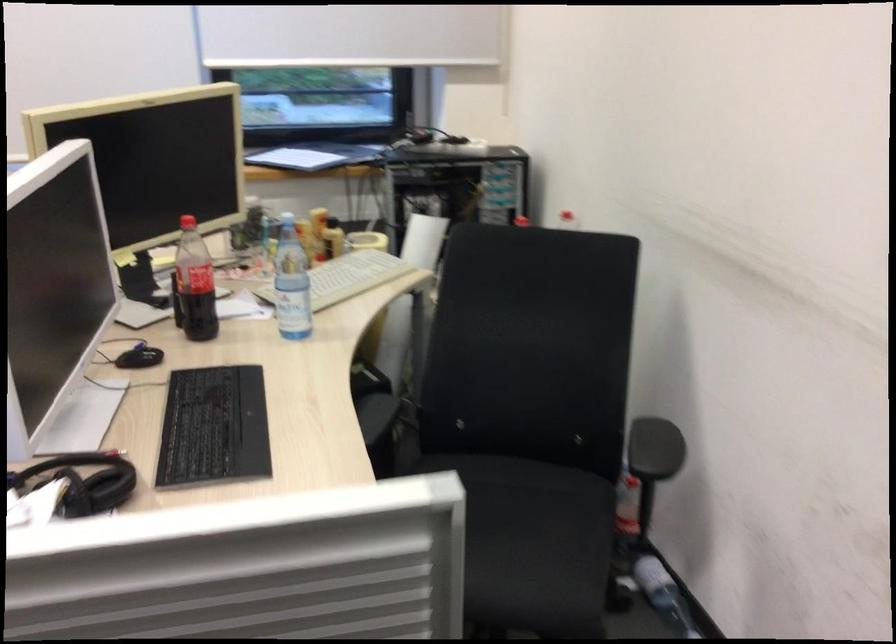
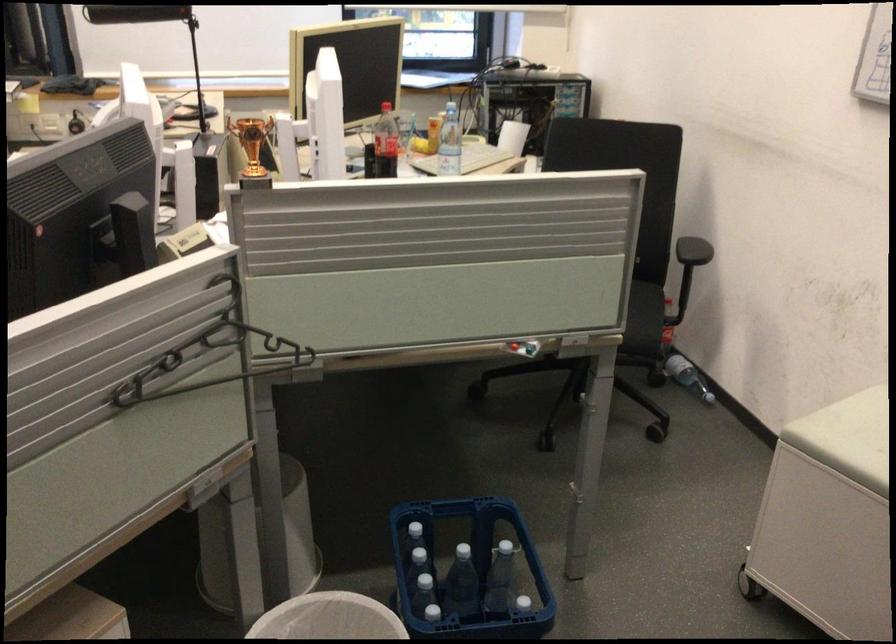
Question: I am providing you with two images of the same scene from different viewpoints. Please identify which objects are invisible in image2.

Choices:
 (A) white cloth curtain
 (B) red button
 (C) black computer mouse
 (D) plastic water bottle

Answer: (C)